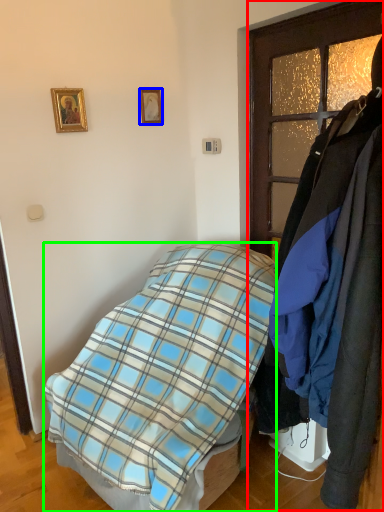
Question: Which object is positioned farthest from closet (highlighted by a red box)? Select from picture frame (highlighted by a blue box) and bed (highlighted by a green box).

Choices:
 (A) picture frame
 (B) bed

Answer: (B)